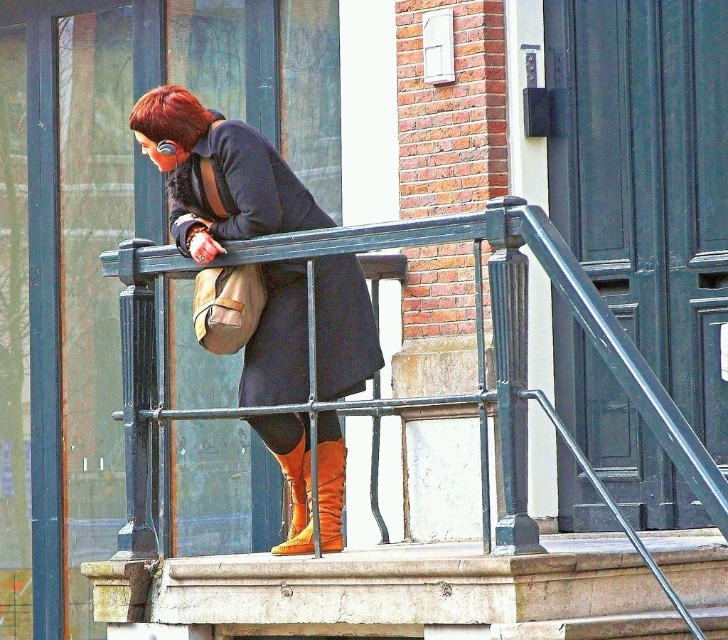
Question: Among these objects, which one is nearest to the camera?

Choices:
 (A) black metal balustrade at center
 (B) shiny brown hair at upper left
 (C) matte black coat at center

Answer: (A)

Question: Which of the following is the closest to the observer?

Choices:
 (A) matte black coat at center
 (B) orange suede boot at lower center
 (C) orange suede boot at center
 (D) shiny brown hair at upper left

Answer: (B)

Question: From the image, what is the correct spatial relationship of matte black coat at center in relation to orange suede boot at center?

Choices:
 (A) left
 (B) right

Answer: (A)

Question: Which object is positioned farthest from the orange suede boot at center?

Choices:
 (A) orange suede boot at lower center
 (B) shiny brown hair at upper left

Answer: (B)

Question: Is black metal balustrade at center above orange suede boot at lower center?

Choices:
 (A) yes
 (B) no

Answer: (A)

Question: Can you confirm if black metal balustrade at center is thinner than matte black coat at center?

Choices:
 (A) yes
 (B) no

Answer: (A)